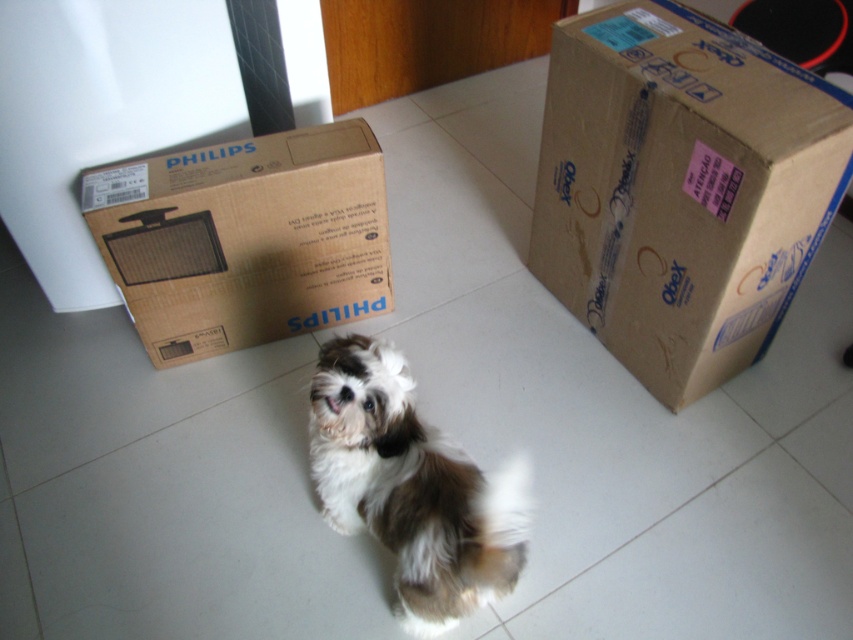
Question: Is brown cardboard box at upper left thinner than fluffy white dog at center?

Choices:
 (A) yes
 (B) no

Answer: (B)

Question: Considering the relative positions of brown cardboard box at upper right and fluffy white dog at center in the image provided, where is brown cardboard box at upper right located with respect to fluffy white dog at center?

Choices:
 (A) left
 (B) right

Answer: (B)

Question: Which point is farther from the camera taking this photo?

Choices:
 (A) (428, 561)
 (B) (125, 294)

Answer: (B)

Question: Which is nearer to the brown cardboard box at upper left?

Choices:
 (A) fluffy white dog at center
 (B) brown cardboard box at upper right

Answer: (A)

Question: Does brown cardboard box at upper right have a larger size compared to fluffy white dog at center?

Choices:
 (A) no
 (B) yes

Answer: (B)

Question: Which point appears closest to the camera in this image?

Choices:
 (A) coord(257,339)
 (B) coord(310,392)
 (C) coord(723,125)

Answer: (B)